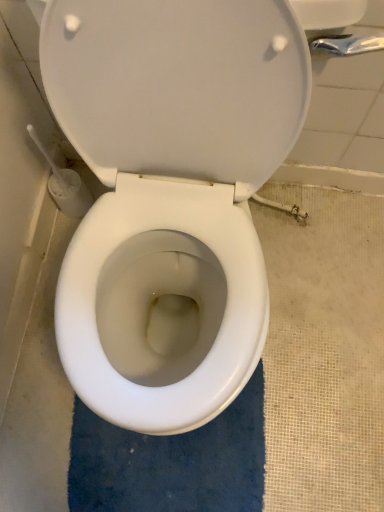
Question: Is blue plush bath mat at center oriented towards white glossy toilet at center?

Choices:
 (A) no
 (B) yes

Answer: (A)

Question: Is blue plush bath mat at center taller than white glossy toilet at center?

Choices:
 (A) no
 (B) yes

Answer: (A)

Question: Does blue plush bath mat at center have a lesser height compared to white glossy toilet at center?

Choices:
 (A) yes
 (B) no

Answer: (A)

Question: Considering the relative sizes of blue plush bath mat at center and white glossy toilet at center in the image provided, is blue plush bath mat at center bigger than white glossy toilet at center?

Choices:
 (A) yes
 (B) no

Answer: (B)

Question: From a real-world perspective, is blue plush bath mat at center on white glossy toilet at center?

Choices:
 (A) no
 (B) yes

Answer: (A)

Question: Is blue plush bath mat at center outside white glossy toilet at center?

Choices:
 (A) no
 (B) yes

Answer: (B)

Question: Is white glossy toilet at center to the right of blue plush bath mat at center from the viewer's perspective?

Choices:
 (A) no
 (B) yes

Answer: (B)

Question: Is white glossy toilet at center bigger than blue plush bath mat at center?

Choices:
 (A) no
 (B) yes

Answer: (B)

Question: From a real-world perspective, is white glossy toilet at center positioned under blue plush bath mat at center based on gravity?

Choices:
 (A) yes
 (B) no

Answer: (B)

Question: Is white glossy toilet at center oriented away from blue plush bath mat at center?

Choices:
 (A) yes
 (B) no

Answer: (B)

Question: Is white glossy toilet at center taller than blue plush bath mat at center?

Choices:
 (A) yes
 (B) no

Answer: (A)

Question: Can we say white glossy toilet at center lies outside blue plush bath mat at center?

Choices:
 (A) no
 (B) yes

Answer: (B)

Question: Visually, is white glossy toilet at center positioned to the left or to the right of blue plush bath mat at center?

Choices:
 (A) left
 (B) right

Answer: (B)